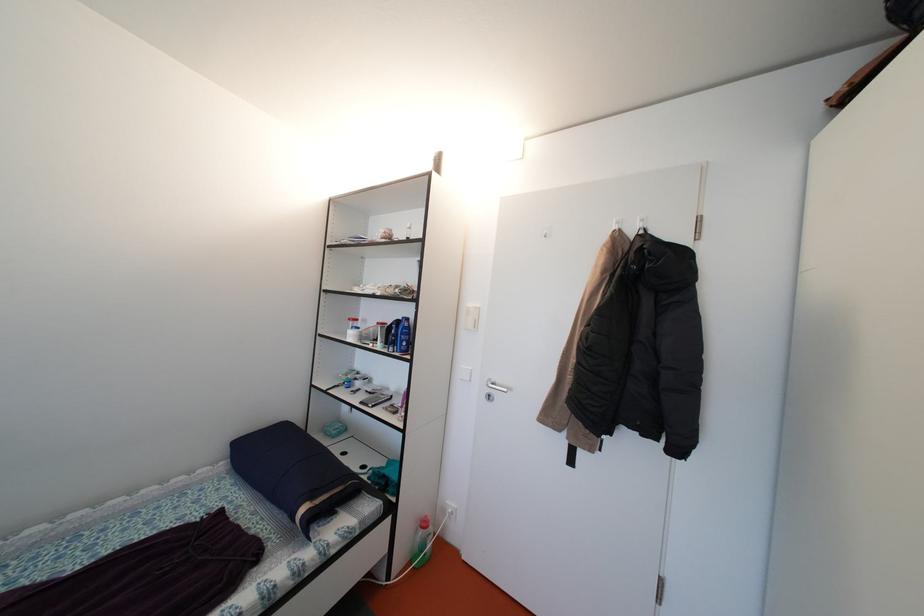
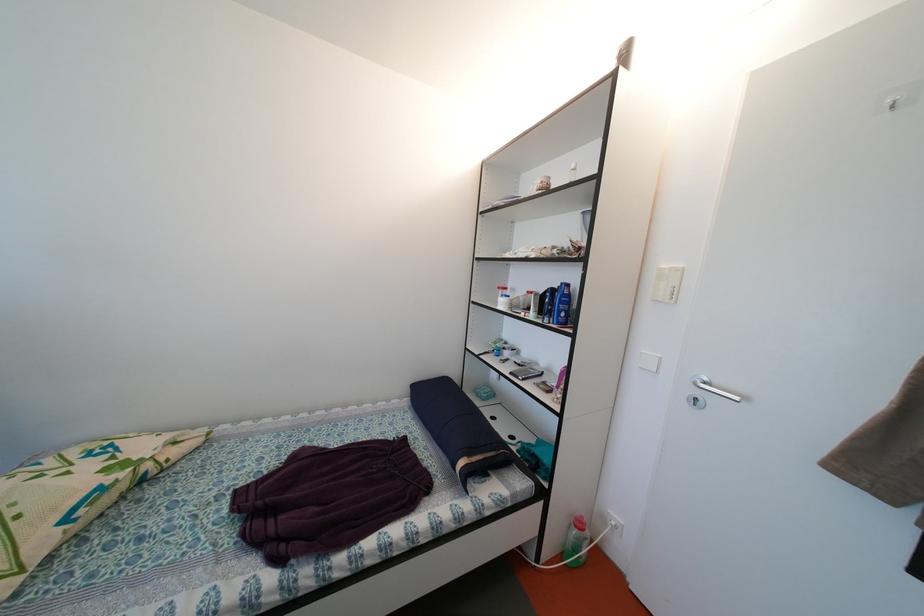
The point at [432,529] is marked in the first image. Where is the corresponding point in the second image?

(587, 530)